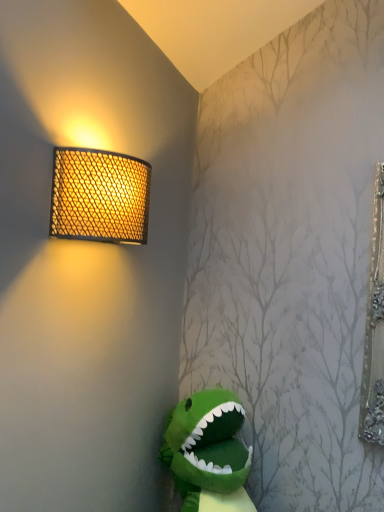
What do you see at coordinates (99, 196) in the screenshot? I see `woven fabric lampshade at upper left` at bounding box center [99, 196].

Where is `woven fabric lampshade at upper left`? The height and width of the screenshot is (512, 384). woven fabric lampshade at upper left is located at coordinates (99, 196).

Identify the location of woven fabric lampshade at upper left. (99, 196).